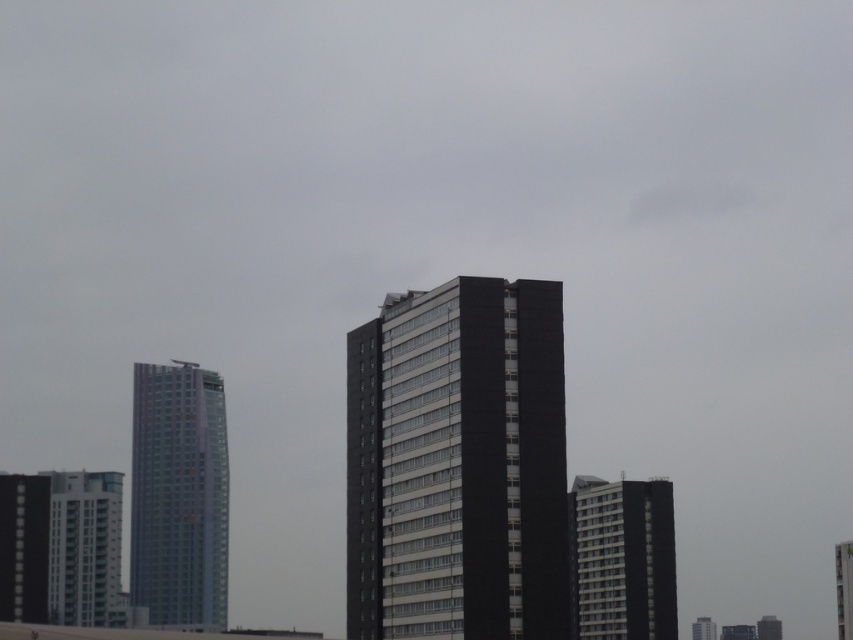
You are a delivery drone with a wingspan of 3 feet. You need to fly from the smooth glass tower at center to the smooth gray building at lower right. Can you safely navigate the space between them without hitting either building?

The distance between the smooth gray building at lower right and the smooth glass tower at center is 42.19 feet. Since your drone has a wingspan of 3 feet, there is ample space to safely navigate between them without any collision risks.

You are a city planner reviewing a new architectural design. You need to determine the spatial relationship between the black matte building at center and the white glossy building at lower right. Based on the image, which building is positioned to the right of the other?

The black matte building at center is to the left of white glossy building at lower right, so the white glossy building at lower right is positioned to the right of the black matte building at center.

You are standing in a city square and want to take a photo of the black matte building at center. The camera you have can focus on objects up to 100 meters away. Will the building be in focus?

The black matte building at center is 101.66 meters away from the viewer, which is beyond the camera focus limit of 100 meters. Therefore, the building will not be in focus.